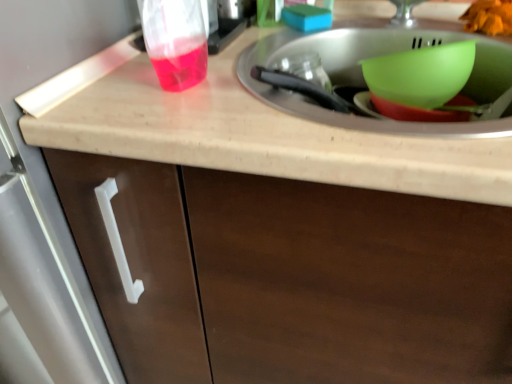
Question: Is orange matte food at upper right facing away from green plastic bowl at upper right?

Choices:
 (A) yes
 (B) no

Answer: (B)

Question: From the image's perspective, is orange matte food at upper right on top of green plastic bowl at upper right?

Choices:
 (A) no
 (B) yes

Answer: (B)

Question: Considering the relative sizes of orange matte food at upper right and green plastic bowl at upper right in the image provided, is orange matte food at upper right taller than green plastic bowl at upper right?

Choices:
 (A) yes
 (B) no

Answer: (B)

Question: Can you confirm if orange matte food at upper right is wider than green plastic bowl at upper right?

Choices:
 (A) no
 (B) yes

Answer: (A)

Question: Considering the relative sizes of orange matte food at upper right and green plastic bowl at upper right in the image provided, is orange matte food at upper right shorter than green plastic bowl at upper right?

Choices:
 (A) no
 (B) yes

Answer: (B)

Question: Visually, is orange matte food at upper right positioned to the left or to the right of transparent plastic cup at upper left?

Choices:
 (A) left
 (B) right

Answer: (B)

Question: From a real-world perspective, is orange matte food at upper right physically located above or below transparent plastic cup at upper left?

Choices:
 (A) above
 (B) below

Answer: (B)

Question: From the image's perspective, relative to transparent plastic cup at upper left, is orange matte food at upper right above or below?

Choices:
 (A) below
 (B) above

Answer: (A)

Question: In terms of width, does orange matte food at upper right look wider or thinner when compared to transparent plastic cup at upper left?

Choices:
 (A) wide
 (B) thin

Answer: (A)

Question: Looking at the image, does transparent plastic cup at upper left seem bigger or smaller compared to green plastic bowl at upper right?

Choices:
 (A) small
 (B) big

Answer: (A)

Question: From their relative heights in the image, would you say transparent plastic cup at upper left is taller or shorter than green plastic bowl at upper right?

Choices:
 (A) short
 (B) tall

Answer: (B)

Question: Is point (141, 38) closer or farther from the camera than point (413, 51)?

Choices:
 (A) farther
 (B) closer

Answer: (A)

Question: Which is correct: transparent plastic cup at upper left is inside green plastic bowl at upper right, or outside of it?

Choices:
 (A) outside
 (B) inside

Answer: (A)

Question: From a real-world perspective, is green plastic bowl at upper right positioned above or below beige matte countertop at upper center?

Choices:
 (A) below
 (B) above

Answer: (B)

Question: Considering the positions of green plastic bowl at upper right and beige matte countertop at upper center in the image, is green plastic bowl at upper right wider or thinner than beige matte countertop at upper center?

Choices:
 (A) thin
 (B) wide

Answer: (A)